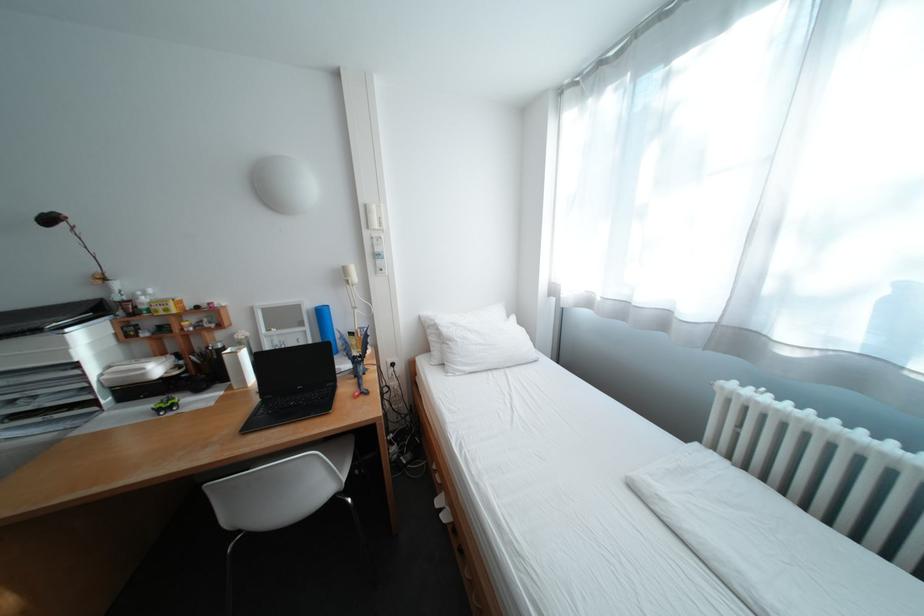
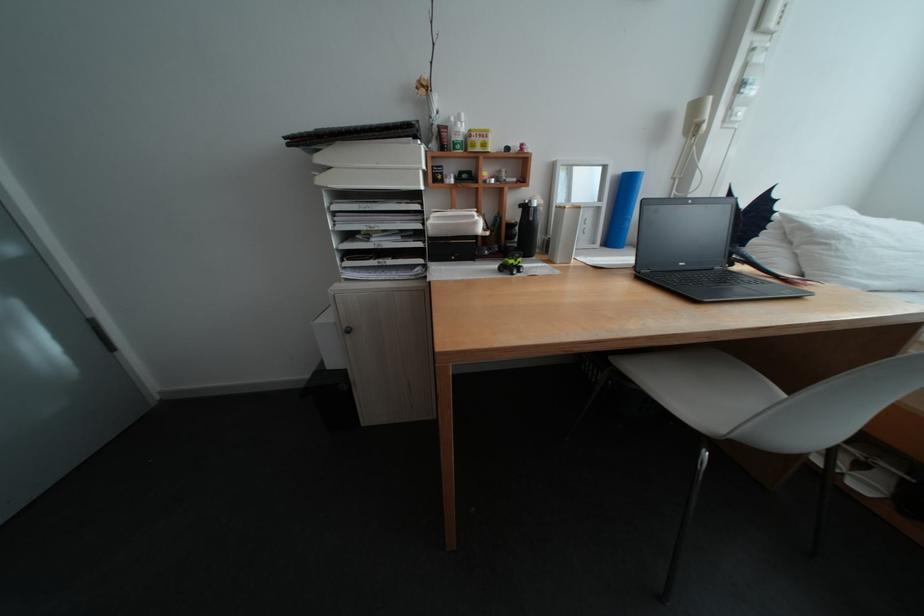
Where in the second image is the point corresponding to point (311, 389) from the first image?

(694, 265)